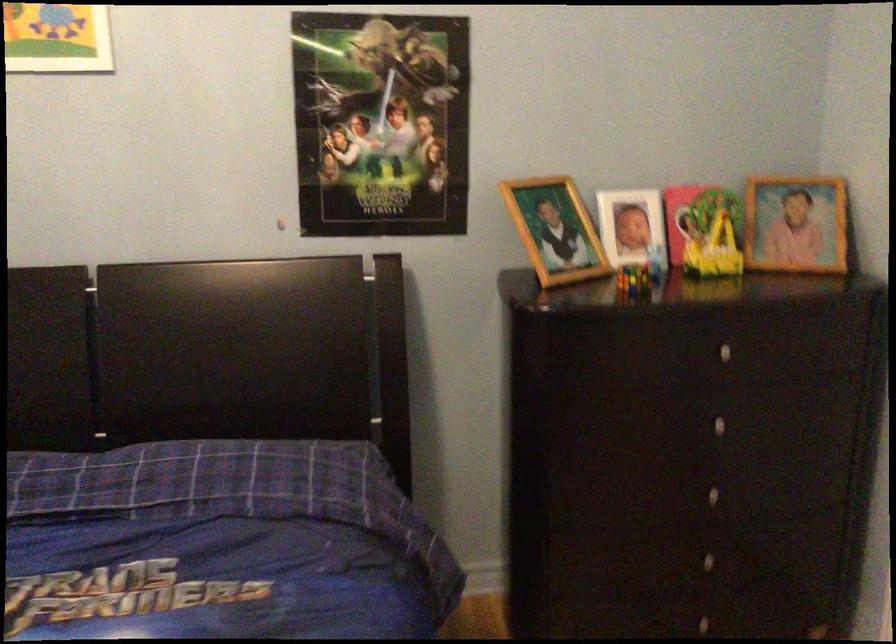
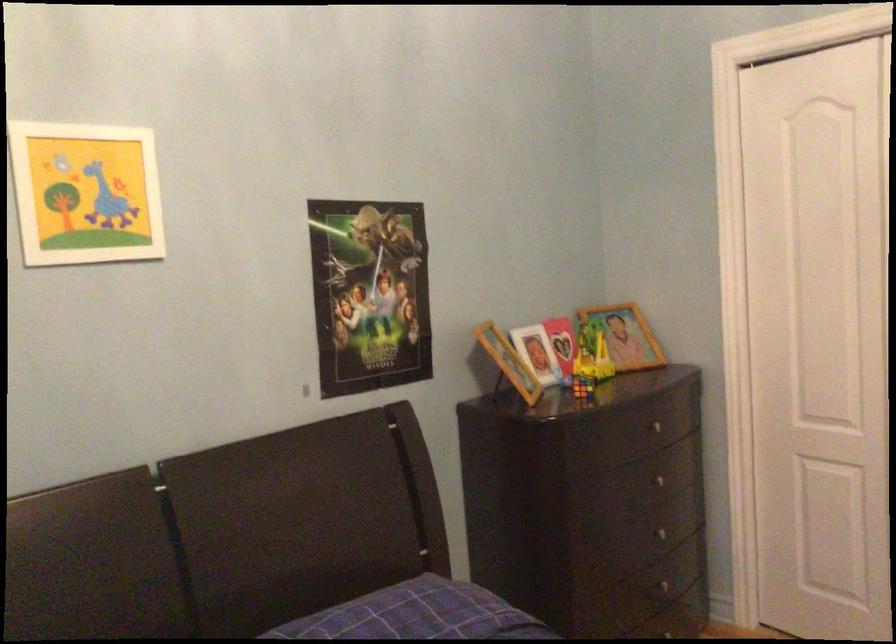
Where in the second image is the point corresponding to pixel 632 275 from the first image?

(582, 386)